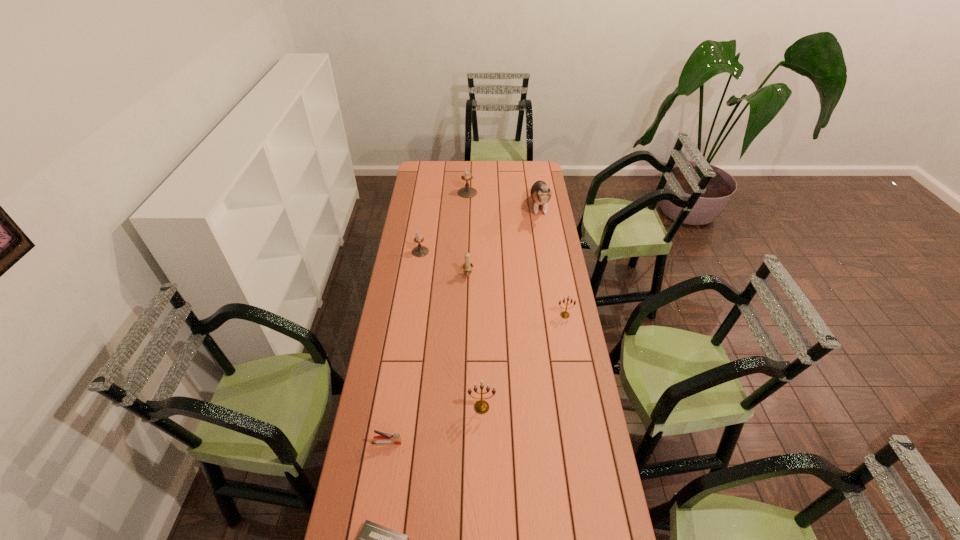
The height and width of the screenshot is (540, 960). I want to click on free area in between the sixth nearest object and the third nearest candelabrum, so click(x=444, y=264).

At what (x,y) coordinates should I click in order to perform the action: click on empty space between the nearest candelabrum and the fifth nearest object. Please return your answer as a coordinate pair (x, y). This screenshot has width=960, height=540. Looking at the image, I should click on (474, 341).

Locate an element on the screen. The width and height of the screenshot is (960, 540). vacant area that lies between the bigger gold candelabrum and the tallest object is located at coordinates (510, 307).

This screenshot has height=540, width=960. I want to click on unoccupied area between the fourth nearest object and the leftmost candelabrum, so click(492, 283).

You are a GUI agent. You are given a task and a screenshot of the screen. Output one action in this format:
    pyautogui.click(x=<x>, y=<y>)
    Task: Click on the unoccupied position between the third farthest candelabrum and the gray stapler
    Image resolution: width=960 pixels, height=540 pixels.
    Given the screenshot: What is the action you would take?
    pyautogui.click(x=427, y=359)

Locate an element on the screen. Image resolution: width=960 pixels, height=540 pixels. unoccupied area between the fourth nearest candelabrum and the bigger gold candelabrum is located at coordinates (451, 329).

The height and width of the screenshot is (540, 960). I want to click on object that is the closest to the fifth nearest object, so click(x=419, y=251).

What are the coordinates of `object that ranks as the closest to the third farthest candelabrum` in the screenshot? It's located at (419, 251).

Find the location of a particular element. This screenshot has width=960, height=540. candelabrum that is the second closest to the smaller gold candelabrum is located at coordinates (481, 406).

Locate which candelabrum is the third closest to the third farthest candelabrum. Please provide its 2D coordinates. Your answer should be formatted as a tuple, i.e. [(x, y)], where the tuple contains the x and y coordinates of a point satisfying the conditions above.

[(466, 192)]